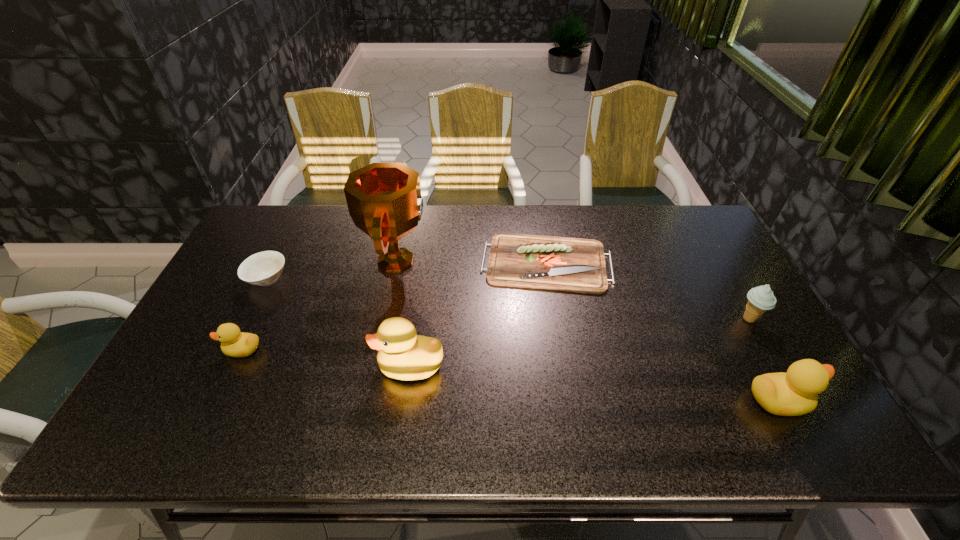
What are the coordinates of `free region at the far left corner` in the screenshot? It's located at (288, 223).

I want to click on unoccupied position between the bowl and the shortest duckling, so tap(254, 314).

At what (x,y) coordinates should I click in order to perform the action: click on vacant space in between the award and the second duckling from left to right. Please return your answer as a coordinate pair (x, y). Looking at the image, I should click on (403, 313).

Where is `empty location between the second duckling from left to right and the shortest object`? empty location between the second duckling from left to right and the shortest object is located at coordinates (478, 314).

Locate an element on the screen. unoccupied position between the second tallest duckling and the icecream is located at coordinates (764, 360).

You are a GUI agent. You are given a task and a screenshot of the screen. Output one action in this format:
    pyautogui.click(x=<x>, y=<y>)
    Task: Click on the empty space that is in between the second tallest duckling and the second duckling from left to right
    
    Given the screenshot: What is the action you would take?
    pyautogui.click(x=595, y=383)

Locate an element on the screen. The height and width of the screenshot is (540, 960). empty location between the chopping board and the second shortest object is located at coordinates (407, 271).

Locate an element on the screen. free spot between the shortest object and the fourth nearest object is located at coordinates (648, 291).

The image size is (960, 540). What are the coordinates of `vacant region between the rightmost duckling and the tallest object` in the screenshot? It's located at (588, 331).

Find the location of a particular element. This screenshot has width=960, height=540. free space between the icecream and the second duckling from left to right is located at coordinates (580, 342).